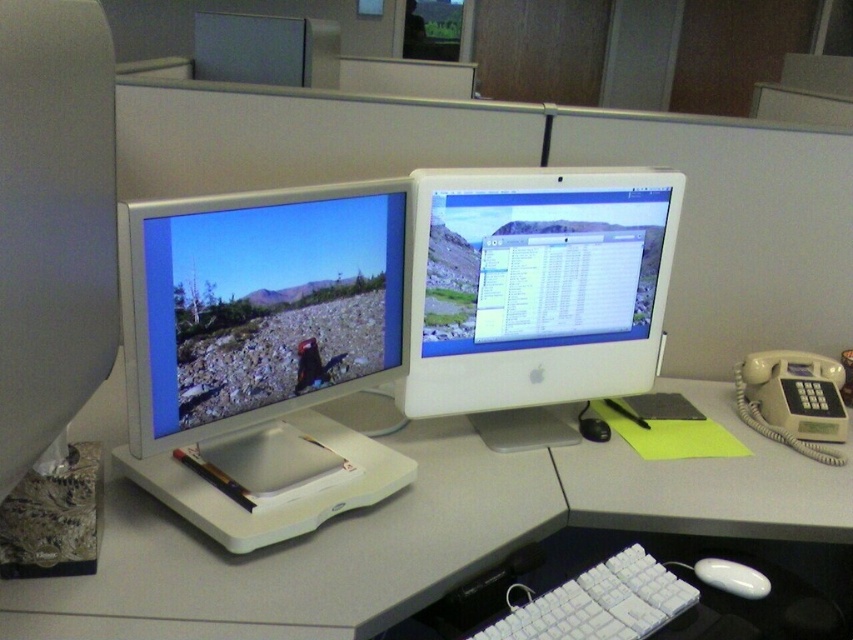
Does satin silver monitor at left lie in front of black plastic mouse at center?

Yes, satin silver monitor at left is in front of black plastic mouse at center.

The image size is (853, 640). What do you see at coordinates (262, 353) in the screenshot? I see `satin silver monitor at left` at bounding box center [262, 353].

Where is `satin silver monitor at left`? This screenshot has width=853, height=640. satin silver monitor at left is located at coordinates (262, 353).

Where is `satin silver monitor at left`? satin silver monitor at left is located at coordinates (262, 353).

Between point (274, 452) and point (747, 593), which one is positioned behind?

The point (274, 452) is behind.

Which is above, satin silver monitor at left or white glossy mouse at lower right?

Positioned higher is satin silver monitor at left.

Looking at this image, who is more distant from viewer, (138, 348) or (704, 579)?

The point (704, 579) is behind.

Where is `satin silver monitor at left`? satin silver monitor at left is located at coordinates (262, 353).

Is point (403, 289) more distant than point (550, 385)?

No.

Which of these two, satin silver monitor at left or white plastic monitor at center, stands shorter?

white plastic monitor at center

Which is behind, point (300, 321) or point (648, 248)?

The point (648, 248) is behind.

The image size is (853, 640). In order to click on satin silver monitor at left in this screenshot , I will do `click(262, 353)`.